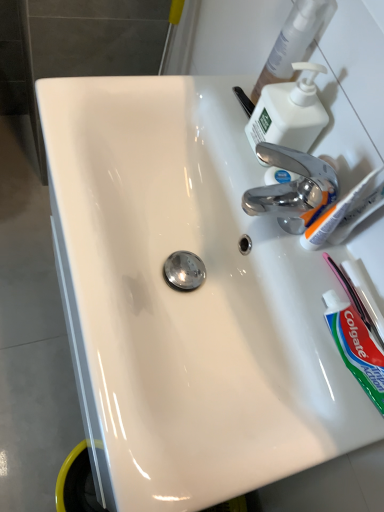
Where is `vacant area to the left of white plastic toothbrush at upper right, which is counted as the 2th toothbrush, starting from the bottom`? The width and height of the screenshot is (384, 512). vacant area to the left of white plastic toothbrush at upper right, which is counted as the 2th toothbrush, starting from the bottom is located at coordinates (245, 188).